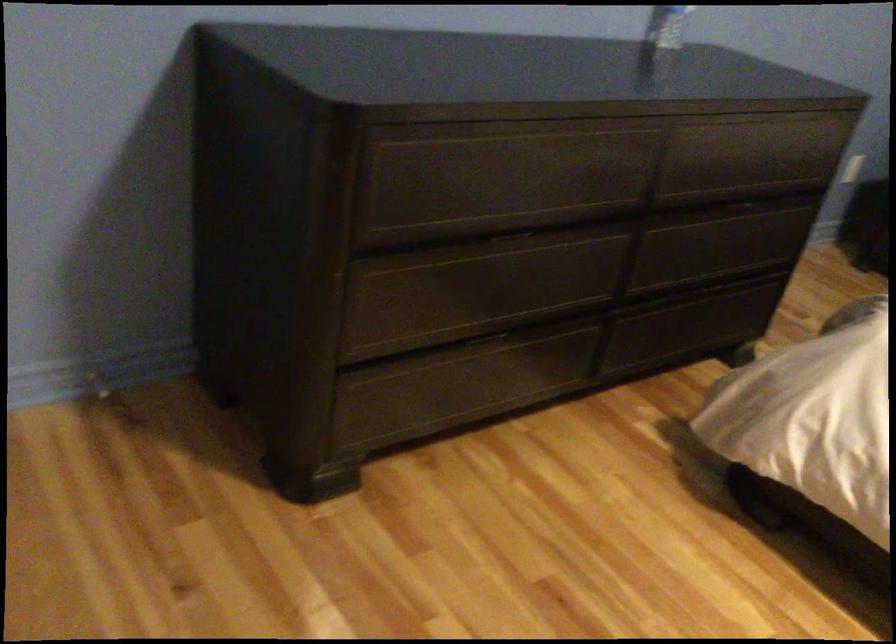
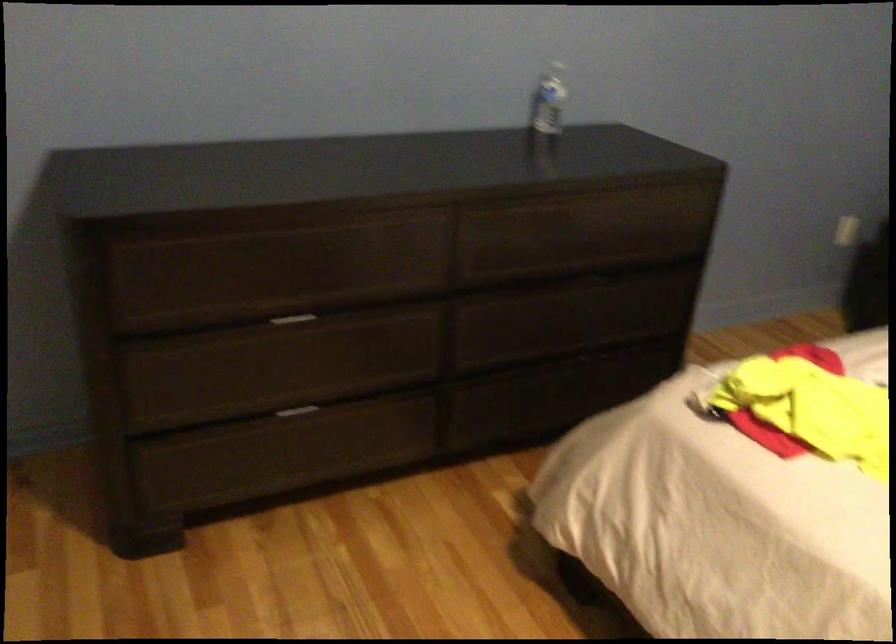
Locate, in the second image, the point that corresponds to (x=504, y=237) in the first image.

(291, 319)